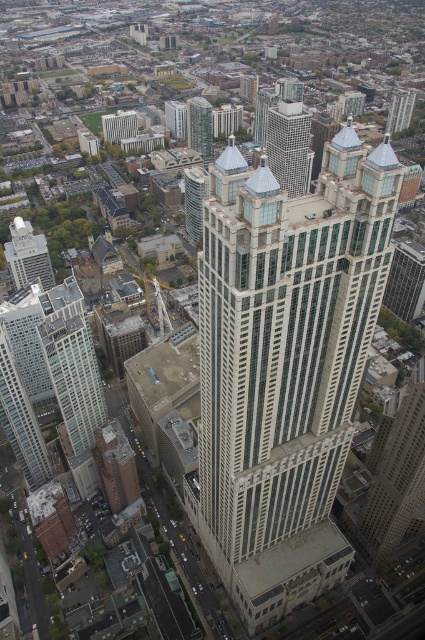
Does glassy white skyscraper at center have a greater height compared to glassy reflective skyscraper at upper center?

Indeed, glassy white skyscraper at center has a greater height compared to glassy reflective skyscraper at upper center.

Who is more distant from viewer, (282, 356) or (209, 157)?

Positioned behind is point (209, 157).

Is point (351, 161) farther from camera compared to point (192, 100)?

No, (351, 161) is closer to viewer.

The height and width of the screenshot is (640, 425). Identify the location of glassy white skyscraper at center. (285, 365).

Measure the distance between glassy steel skyscraper at center and glassy reflective skyscraper at upper center.

glassy steel skyscraper at center and glassy reflective skyscraper at upper center are 85.96 meters apart.

Between glassy steel skyscraper at center and glassy reflective skyscraper at upper center, which one appears on the left side from the viewer's perspective?

glassy reflective skyscraper at upper center is more to the left.

Based on the photo, measure the distance between point [274,132] and camera.

Point [274,132] and camera are 1770.52 feet apart from each other.

Where is `glassy steel skyscraper at center`? glassy steel skyscraper at center is located at coordinates (289, 145).

Which is more to the right, glassy white skyscraper at center or glassy steel skyscraper at center?

glassy steel skyscraper at center

The image size is (425, 640). I want to click on glassy white skyscraper at center, so click(x=285, y=365).

The image size is (425, 640). In order to click on glassy white skyscraper at center in this screenshot , I will do `click(285, 365)`.